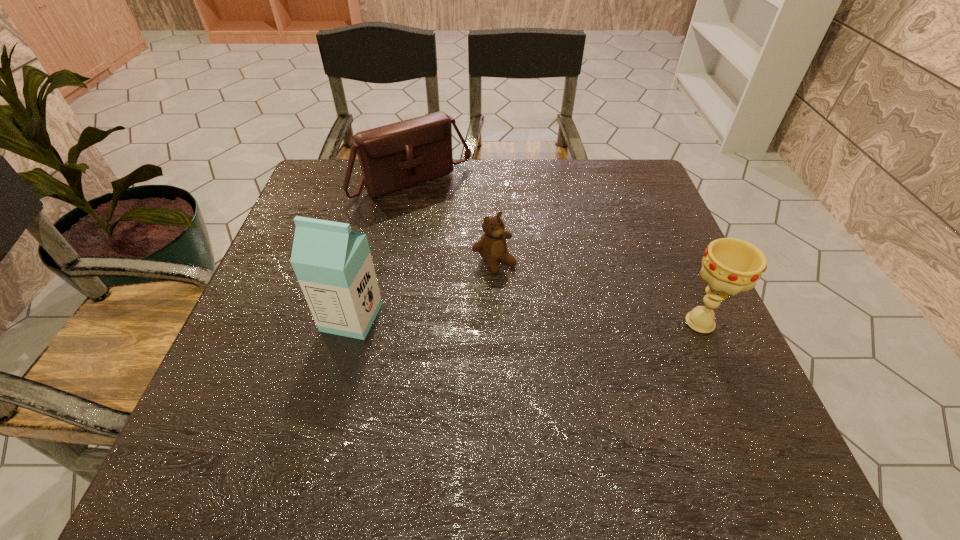
Where is `the tallest object`? Image resolution: width=960 pixels, height=540 pixels. the tallest object is located at coordinates (333, 264).

At what (x,y) coordinates should I click in order to perform the action: click on chalice. Please return your answer as a coordinate pair (x, y). Looking at the image, I should click on (729, 266).

The height and width of the screenshot is (540, 960). What are the coordinates of `shoulder bag` in the screenshot? It's located at (396, 156).

Locate an element on the screen. The width and height of the screenshot is (960, 540). the third object from left to right is located at coordinates (492, 246).

I want to click on teddy bear, so click(492, 246).

Find the location of a particular element. Image resolution: width=960 pixels, height=540 pixels. vacant space located on the right of the milk carton is located at coordinates (572, 317).

Locate an element on the screen. This screenshot has height=540, width=960. vacant space situated on the left of the chalice is located at coordinates (651, 322).

Find the location of a particular element. This screenshot has height=540, width=960. vacant space located on the front flap of the shoulder bag is located at coordinates (462, 225).

At what (x,y) coordinates should I click in order to perform the action: click on vacant region located 0.180m on the front flap of the shoulder bag. Please return your answer as a coordinate pair (x, y). The image size is (960, 540). Looking at the image, I should click on 477,240.

You are a GUI agent. You are given a task and a screenshot of the screen. Output one action in this format:
    pyautogui.click(x=<x>, y=<y>)
    Task: Click on the vacant space located on the front flap of the shoulder bag
    The width and height of the screenshot is (960, 540).
    Given the screenshot: What is the action you would take?
    pyautogui.click(x=516, y=282)